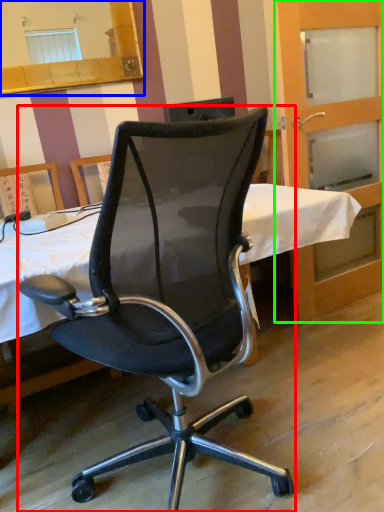
Question: Considering the real-world distances, which object is farthest from chair (highlighted by a red box)? mirror (highlighted by a blue box) or screen door (highlighted by a green box)?

Choices:
 (A) mirror
 (B) screen door

Answer: (A)